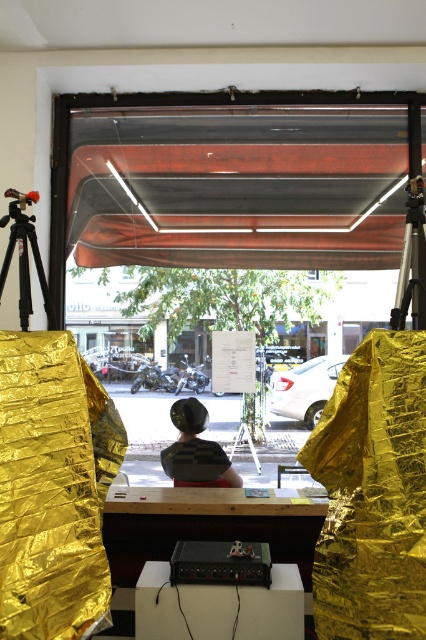
Question: Which object is farther from the camera taking this photo?

Choices:
 (A) wooden table at center
 (B) white matte table at center
 (C) matte black helmet at center
 (D) silver metallic tripod at right

Answer: (C)

Question: Can you confirm if wooden table at center is positioned above silver metallic tripod at right?

Choices:
 (A) yes
 (B) no

Answer: (B)

Question: Does wooden table at center have a larger size compared to matte black helmet at center?

Choices:
 (A) no
 (B) yes

Answer: (B)

Question: Can you confirm if wooden table at center is positioned to the right of silver metallic tripod at right?

Choices:
 (A) no
 (B) yes

Answer: (A)

Question: Which object is farther from the camera taking this photo?

Choices:
 (A) white matte table at center
 (B) silver metallic tripod at right
 (C) wooden table at center
 (D) matte black helmet at center

Answer: (D)

Question: Which object appears closest to the camera in this image?

Choices:
 (A) matte black tripod at left
 (B) white matte table at center

Answer: (A)